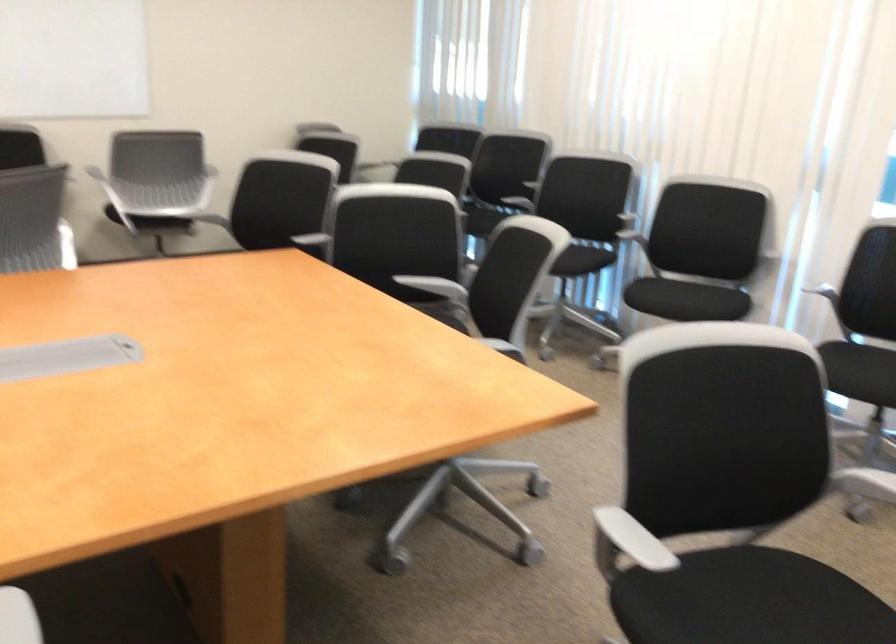
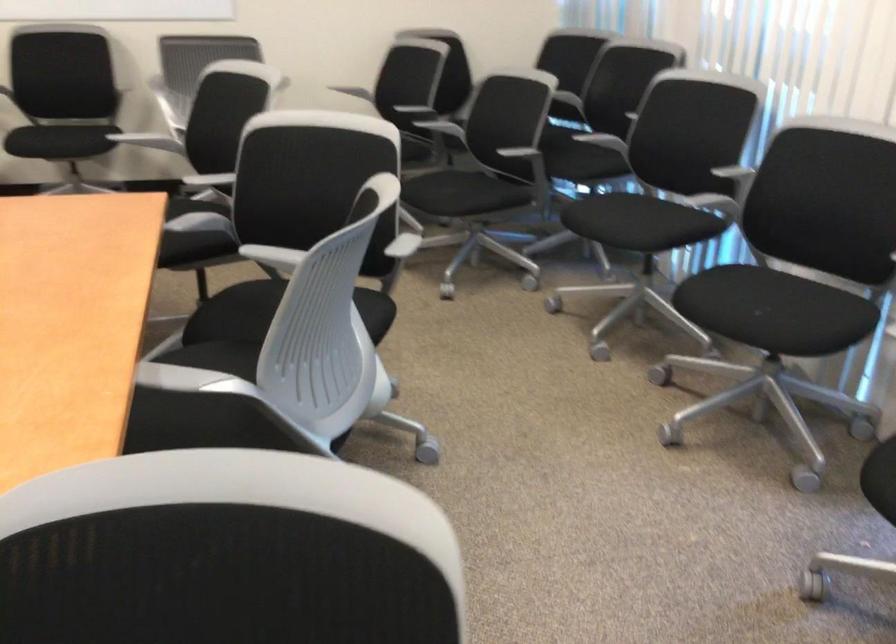
In the second image, find the point that corresponds to point (699, 292) in the first image.

(771, 310)